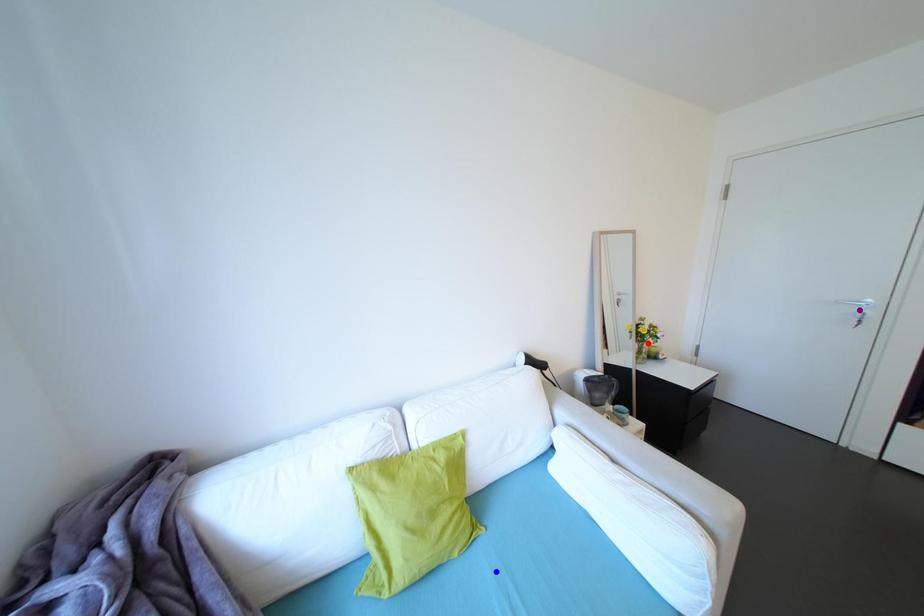
Order these from nearest to farthest:
1. purple point
2. red point
3. blue point

red point → purple point → blue point